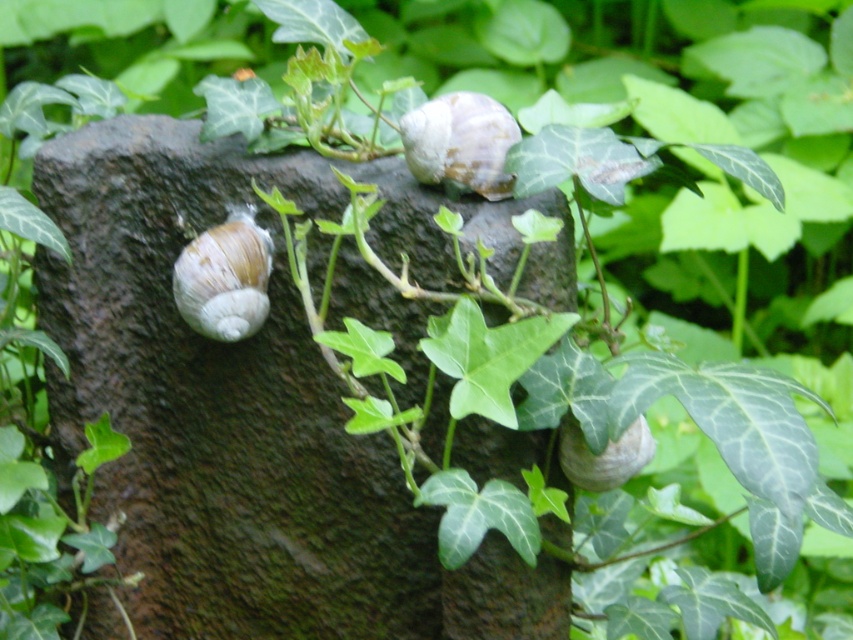
You are a gardener who wants to place a small plant pot between the matte brown shell at left and the white matte snail at upper center. Considering their sizes, which object should the pot be closer to?

The matte brown shell at left is much taller than the white matte snail at upper center, so the pot should be placed closer to the white matte snail at upper center to balance the height difference.